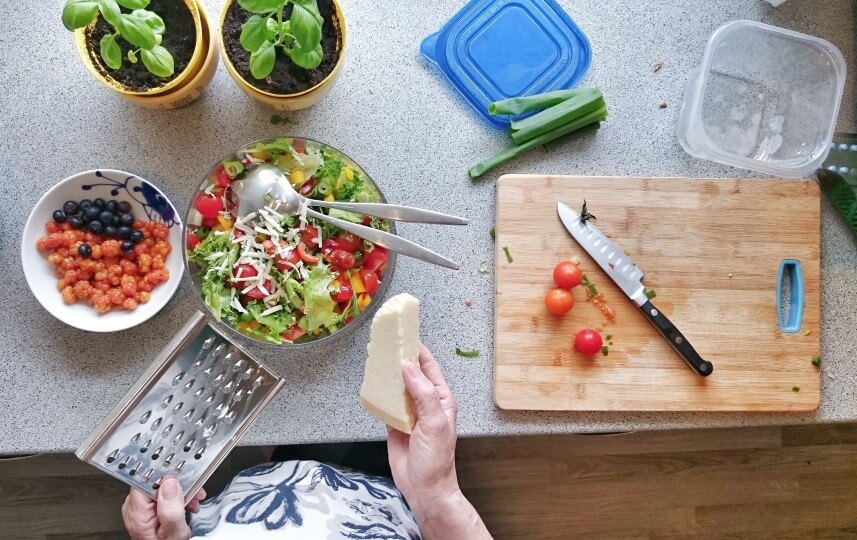
The image size is (857, 540). I want to click on the top to food storage container, so click(x=512, y=54).